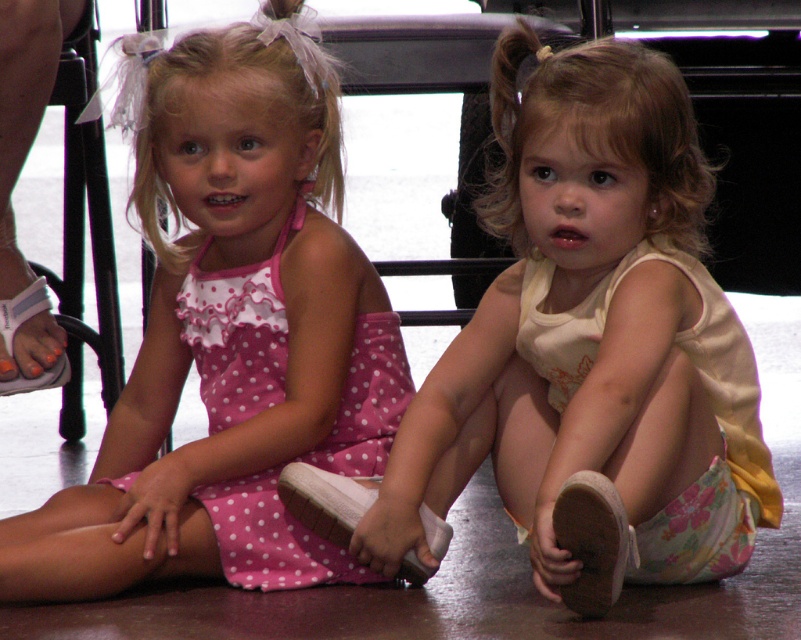
You are a parent trying to organize the shoes of your two children. You notice the white suede sandal at lower center. Based on their clothing, which child is more likely to have misplaced this sandal?

The white suede sandal at lower center is more likely to belong to the child on the left wearing the pink dress with white polka dots, as the sandal color matches the dress color scheme better.

You are a parent trying to organize your childrens shoes. You see the white suede sandal at lower center and the white fabric sandal at left. Can you tell me which one is closer to the front of the vehicle?

The white fabric sandal at left is closer to the front of the vehicle because the distance between the white suede sandal at lower center and the white fabric sandal at left is 1.49 meters, so the white fabric sandal at left is closer to the front.

You are a parent trying to ensure your children are properly dressed before leaving the house. You notice the pink polka dot dress at left and the white fabric shoe at lower right in the image. Which child is not wearing their shoe?

The child wearing the pink polka dot dress at left is not wearing their shoe because the pink polka dot dress at left is positioned over the white fabric shoe at lower right, indicating the shoe is not on their foot.